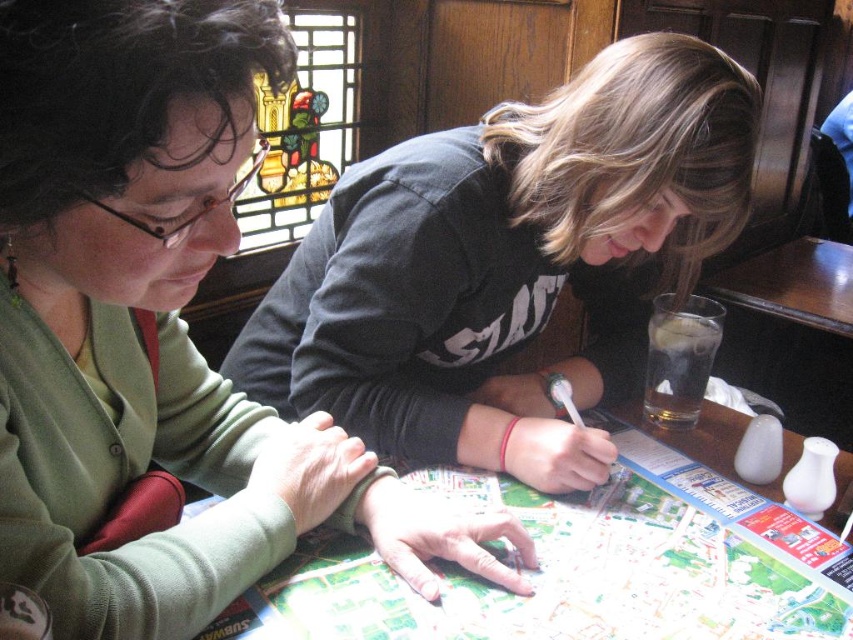
You are observing two people working at a table. The green matte sweater at upper left and the white paper map at center are visible. Which object is nearer to you?

The green matte sweater at upper left is closer to the viewer than the white paper map at center.

You are standing at the table in the image. There are two points marked on the map. The first point is at coordinates point (190, 102) and the second is at point (827, 243). Which point is closer to you?

Point (190, 102) is in front of point (827, 243), so it is closer to you.

You are a photographer standing at a distance of 14 inches from the scene. You want to take a closeup shot of the green matte sweater at upper left. Is the sweater within your camera focus range if your camera can focus as close as 12 inches?

The green matte sweater at upper left is 14.07 inches away from the camera, which is within the camera focus range since it can focus as close as 12 inches.